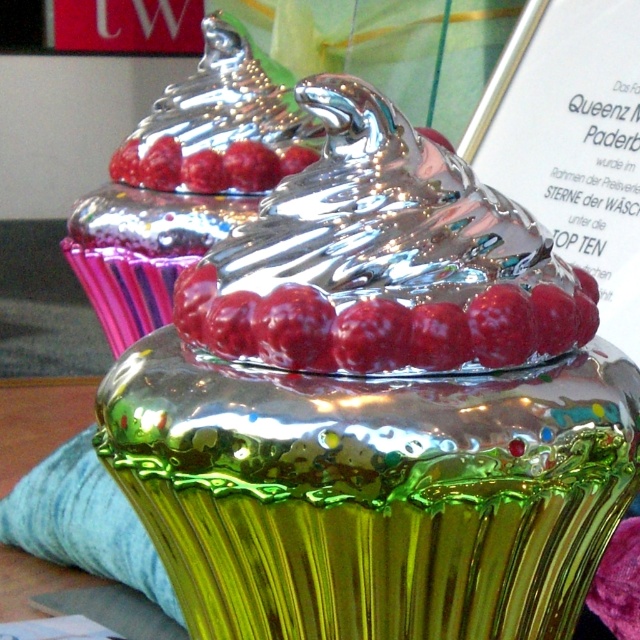
You are a photographer holding a camera at a distance of 34.61 inches from the shiny metallic muffin at center. Can you capture the entire muffin in your photo without moving closer or further away?

The shiny metallic muffin at center and camera are 34.61 inches apart from each other. To determine if the entire muffin can be captured, you need to consider the camera lens and sensor size. However, based on the given information, the distance is fixed at 34.61 inches. Without additional details about the camera specifications, it is impossible to confirm if the entire muffin will fit in the frame.

In the scene shown: You are a baker who wants to place both the shiny metallic muffin at center and the shiny metallic raspberry at center on a small dessert plate. The plate can only hold items that are smaller than 10 cm in diameter. Can both items fit on the plate?

The shiny metallic muffin at center has a larger size compared to the shiny metallic raspberry at center. Since the muffin is larger, if it is under 10 cm, both can fit. However, if the muffin exceeds 10 cm, only the raspberry would fit. Without exact measurements, we cannot confirm. Please check the muffin size.